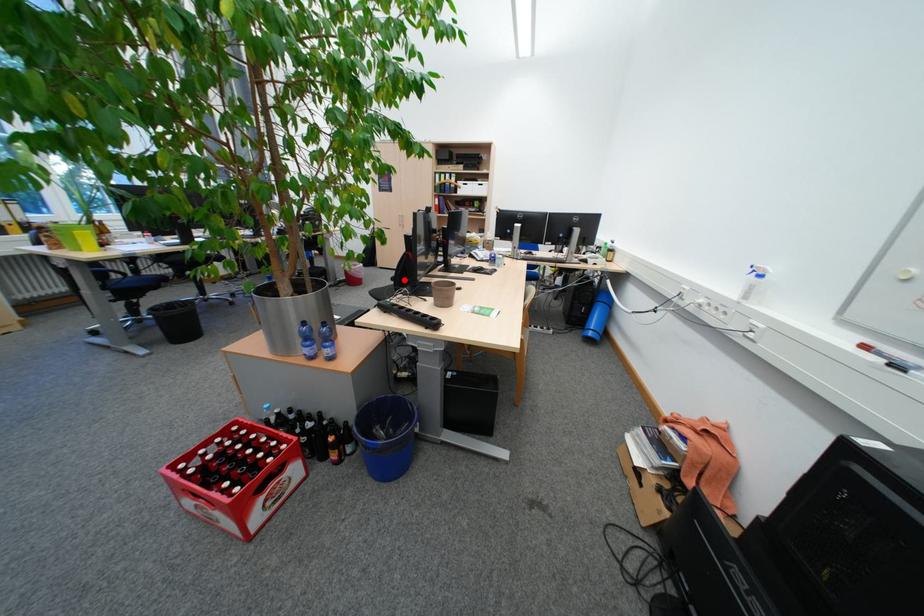
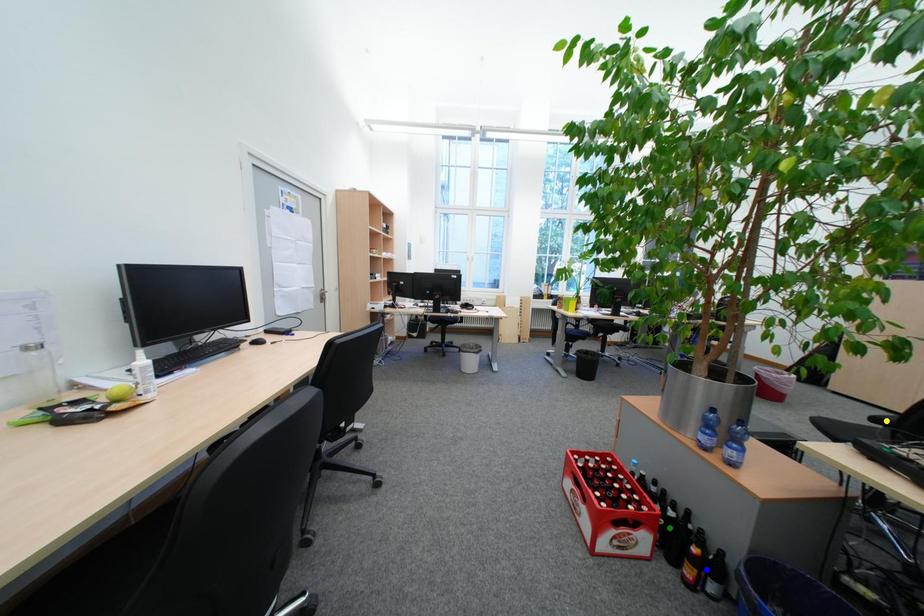
Question: I am providing you with two images of the same scene from different viewpoints. A red point is marked on the first image. You are given multiple points on the second image. Can you choose the point in image 2 that corresponds to the point in image 1?

Choices:
 (A) yellow point
 (B) green point
 (C) blue point

Answer: (A)